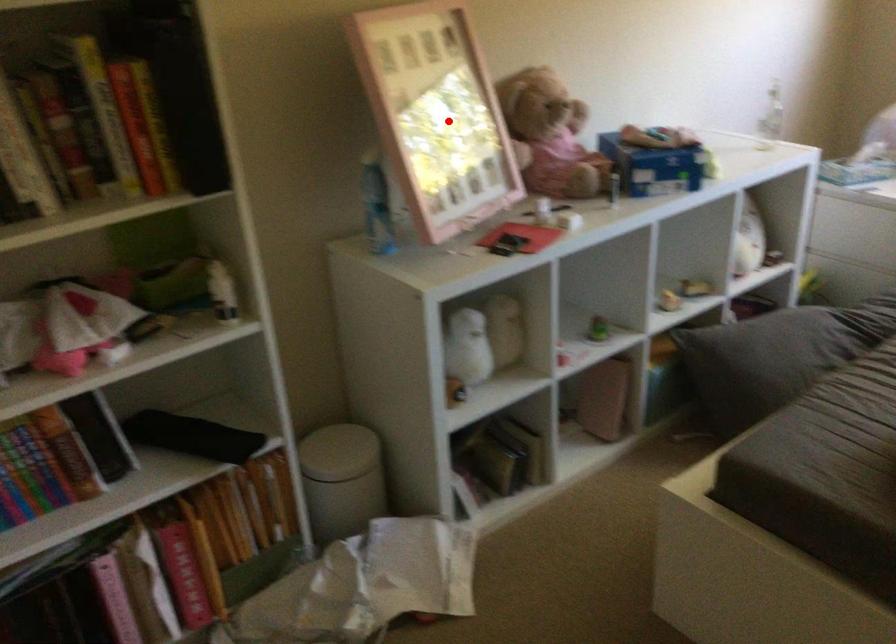
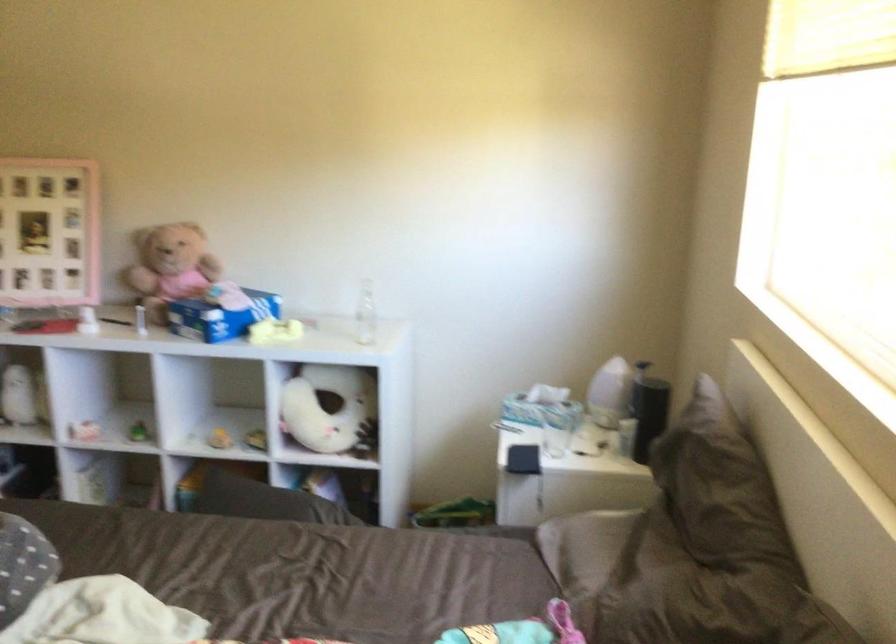
Question: I am providing you with two images of the same scene from different viewpoints. Given a red point in image1, look at the same physical point in image2. Is it:

Choices:
 (A) Closer to the viewpoint
 (B) Farther from the viewpoint

Answer: (B)